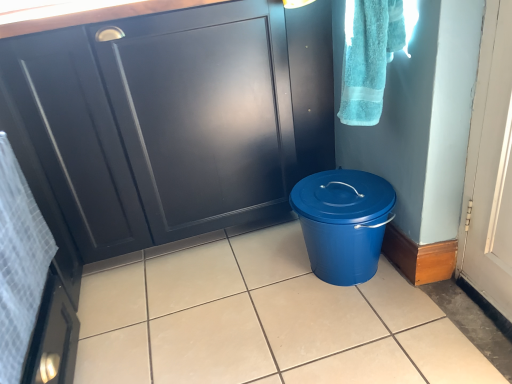
Question: Considering the relative positions of blue plastic bucket at lower right and turquoise cotton towel at upper right, the second bath towel in the bottom-to-top sequence, in the image provided, is blue plastic bucket at lower right to the right of turquoise cotton towel at upper right, the second bath towel in the bottom-to-top sequence, from the viewer's perspective?

Choices:
 (A) no
 (B) yes

Answer: (A)

Question: Is blue plastic bucket at lower right next to turquoise cotton towel at upper right, marked as the 1th bath towel in a top-to-bottom arrangement, and touching it?

Choices:
 (A) yes
 (B) no

Answer: (B)

Question: From the image's perspective, is blue plastic bucket at lower right beneath turquoise cotton towel at upper right, positioned as the 2th bath towel in left-to-right order?

Choices:
 (A) no
 (B) yes

Answer: (B)

Question: From a real-world perspective, is blue plastic bucket at lower right located higher than turquoise cotton towel at upper right, marked as the 1th bath towel in a top-to-bottom arrangement?

Choices:
 (A) yes
 (B) no

Answer: (B)

Question: Is blue plastic bucket at lower right bigger than turquoise cotton towel at upper right, marked as the 1th bath towel in a top-to-bottom arrangement?

Choices:
 (A) yes
 (B) no

Answer: (A)

Question: Can you confirm if blue plastic bucket at lower right is smaller than turquoise cotton towel at upper right, marked as the 1th bath towel in a top-to-bottom arrangement?

Choices:
 (A) no
 (B) yes

Answer: (A)

Question: Is matte black cabinet at center not close to turquoise cotton towel at upper right, the second bath towel in the bottom-to-top sequence?

Choices:
 (A) yes
 (B) no

Answer: (B)

Question: Would you say matte black cabinet at center is outside turquoise cotton towel at upper right, the second bath towel in the bottom-to-top sequence?

Choices:
 (A) no
 (B) yes

Answer: (B)

Question: From a real-world perspective, is matte black cabinet at center beneath turquoise cotton towel at upper right, marked as the 1th bath towel in a top-to-bottom arrangement?

Choices:
 (A) yes
 (B) no

Answer: (A)

Question: Is matte black cabinet at center at the left side of turquoise cotton towel at upper right, positioned as the 2th bath towel in left-to-right order?

Choices:
 (A) no
 (B) yes

Answer: (B)

Question: Considering the relative sizes of matte black cabinet at center and turquoise cotton towel at upper right, the first bath towel when ordered from right to left, in the image provided, is matte black cabinet at center taller than turquoise cotton towel at upper right, the first bath towel when ordered from right to left,?

Choices:
 (A) yes
 (B) no

Answer: (A)

Question: From the image's perspective, is matte black cabinet at center under turquoise cotton towel at upper right, the first bath towel when ordered from right to left?

Choices:
 (A) no
 (B) yes

Answer: (B)

Question: Is matte black cabinet at center to the left of matte blue bucket at center from the viewer's perspective?

Choices:
 (A) no
 (B) yes

Answer: (B)